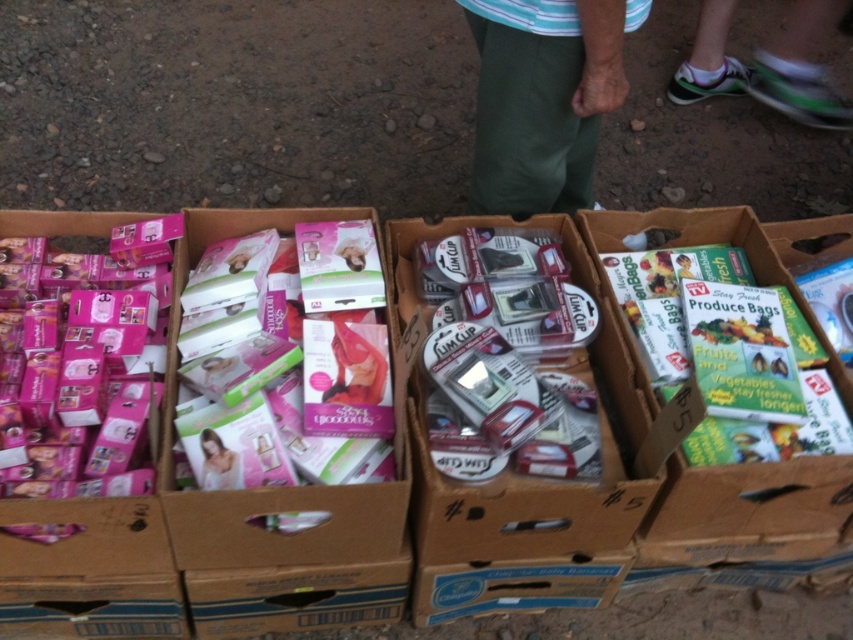
You are a customer at a market stall with a 32 inch wide backpack. You want to place your backpack between the green cotton pants at center and the pink matte baby carrier at center. Is there enough space between them to fit your backpack?

The distance between the green cotton pants at center and the pink matte baby carrier at center is 33.14 inches. Since your backpack is 32 inches wide, it should fit comfortably between them with a little extra space remaining.

Consider the image. You are a customer at the market stall and want to pick up both the green cotton pants at center and the pink matte baby carrier at center. Which item should you reach for first to grab the one closer to you?

The green cotton pants at center is closer to the viewer than the pink matte baby carrier at center, so you should reach for the green cotton pants at center first.

Consider the image. You are a customer at a market stall and see the green cotton pants at center and the white mesh shoe at upper right. Which item is shorter in height?

The green cotton pants at center is not as tall as the white mesh shoe at upper right, so the green cotton pants at center is shorter in height.